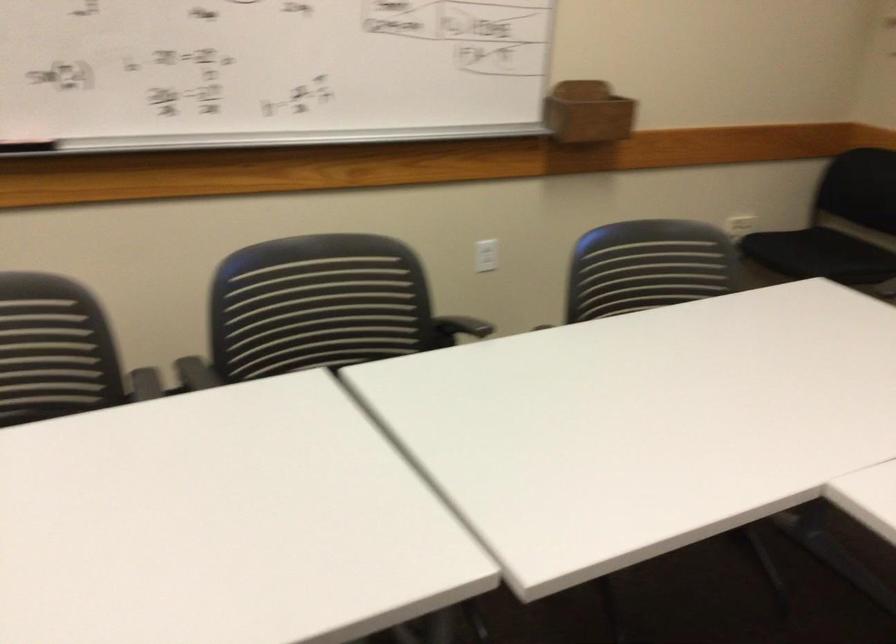
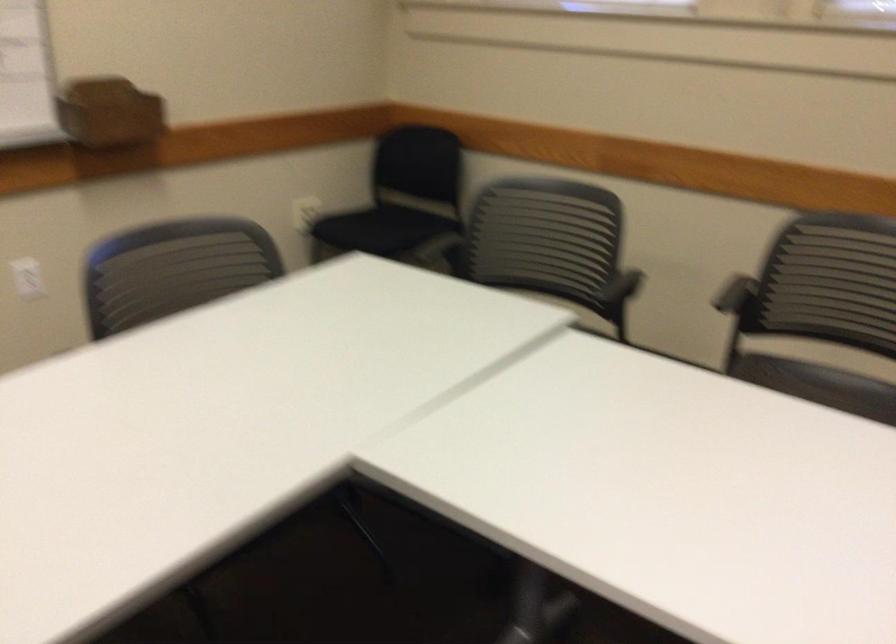
Question: Which direction would the cameraman need to move to produce the second image? Reply with the corresponding letter.

Choices:
 (A) Left
 (B) Right
 (C) Forward
 (D) Backward

Answer: (B)